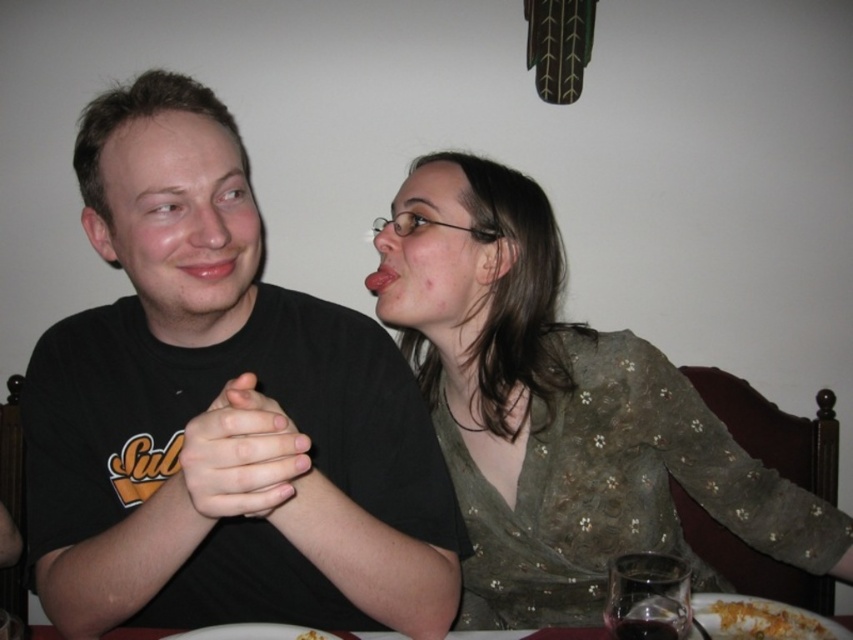
Question: In this image, where is green textured blouse at center located relative to yellowish matte pasta at lower center?

Choices:
 (A) below
 (B) above

Answer: (B)

Question: Which object is positioned closest to the yellowish matte pasta at lower center?

Choices:
 (A) black matte shirt at center
 (B) matte black hands at center
 (C) green textured blouse at center

Answer: (A)

Question: Based on their relative distances, which object is farther from the green textured blouse at center?

Choices:
 (A) matte black hands at center
 (B) yellowish crumbly food at lower right

Answer: (A)

Question: Is green textured blouse at center positioned at the back of yellowish matte pasta at lower center?

Choices:
 (A) no
 (B) yes

Answer: (B)

Question: Can you confirm if green textured blouse at center is positioned above yellowish matte pasta at lower center?

Choices:
 (A) yes
 (B) no

Answer: (A)

Question: Among these objects, which one is farthest from the camera?

Choices:
 (A) matte black hands at center
 (B) yellowish matte pasta at lower center
 (C) green textured blouse at center

Answer: (C)